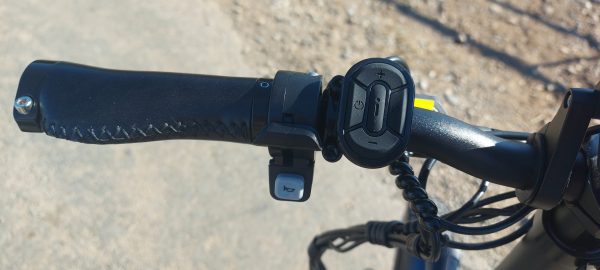
Identify the location of bar. (452, 132).